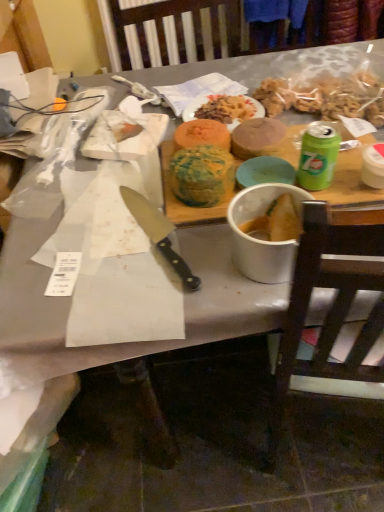
The height and width of the screenshot is (512, 384). Describe the element at coordinates (202, 134) in the screenshot. I see `multicolored cake at center, placed as the second food when sorted from left to right` at that location.

Find the location of `smooth brown cake at center, the 1th food when ordered from right to left`. smooth brown cake at center, the 1th food when ordered from right to left is located at coordinates (257, 138).

The width and height of the screenshot is (384, 512). I want to click on multicolored cake at center, the 2th food in the right-to-left sequence, so click(x=202, y=134).

Between brown wooden chair at right and green and yellow cake at center, placed as the 1th food when sorted from left to right, which one appears on the left side from the viewer's perspective?

green and yellow cake at center, placed as the 1th food when sorted from left to right.

From the image's perspective, is brown wooden chair at right located above or below green and yellow cake at center, the third food viewed from the right?

brown wooden chair at right is below green and yellow cake at center, the third food viewed from the right.

How different are the orientations of brown wooden chair at right and green and yellow cake at center, the third food viewed from the right, in degrees?

The angular difference between brown wooden chair at right and green and yellow cake at center, the third food viewed from the right, is 167 degrees.

Is brown wooden chair at right facing towards green and yellow cake at center, the third food viewed from the right?

No, brown wooden chair at right is not aimed at green and yellow cake at center, the third food viewed from the right.

Find the location of `knife that appears on the left of smooth brown cake at center, the 3th food when ordered from left to right`. knife that appears on the left of smooth brown cake at center, the 3th food when ordered from left to right is located at coordinates (159, 234).

Can you confirm if smooth brown cake at center, the 1th food when ordered from right to left, is wider than black plastic knife at center?

No.

How much distance is there between smooth brown cake at center, the 3th food when ordered from left to right, and black plastic knife at center?

26.88 centimeters.

Does smooth brown cake at center, the 3th food when ordered from left to right, have a smaller size compared to black plastic knife at center?

No.

What's the angular difference between black plastic knife at center and smooth brown cake at center, the 3th food when ordered from left to right,'s facing directions?

black plastic knife at center and smooth brown cake at center, the 3th food when ordered from left to right, are facing 21.4 degrees away from each other.

How far apart are black plastic knife at center and smooth brown cake at center, the 1th food when ordered from right to left?

black plastic knife at center is 10.58 inches away from smooth brown cake at center, the 1th food when ordered from right to left.

Does point (188, 285) come behind point (278, 136)?

No, (188, 285) is in front of (278, 136).

Considering the relative sizes of black plastic knife at center and smooth brown cake at center, the 1th food when ordered from right to left, in the image provided, is black plastic knife at center bigger than smooth brown cake at center, the 1th food when ordered from right to left,?

No, black plastic knife at center is not bigger than smooth brown cake at center, the 1th food when ordered from right to left.

How distant is multicolored cake at center, placed as the second food when sorted from left to right, from white matte bowl at center?

multicolored cake at center, placed as the second food when sorted from left to right, and white matte bowl at center are 24.19 centimeters apart from each other.

Considering the relative sizes of multicolored cake at center, placed as the second food when sorted from left to right, and white matte bowl at center in the image provided, is multicolored cake at center, placed as the second food when sorted from left to right, wider than white matte bowl at center?

Incorrect, the width of multicolored cake at center, placed as the second food when sorted from left to right, does not surpass that of white matte bowl at center.

Is multicolored cake at center, placed as the second food when sorted from left to right, inside or outside of white matte bowl at center?

multicolored cake at center, placed as the second food when sorted from left to right, is not enclosed by white matte bowl at center.

Between multicolored cake at center, the 2th food in the right-to-left sequence, and white matte bowl at center, which one appears on the right side from the viewer's perspective?

white matte bowl at center.

From the picture: How different are the orientations of black plastic knife at center and multicolored cake at center, placed as the second food when sorted from left to right, in degrees?

21.4 degrees separate the facing orientations of black plastic knife at center and multicolored cake at center, placed as the second food when sorted from left to right.

Locate an element on the screen. Image resolution: width=384 pixels, height=512 pixels. knife in front of the multicolored cake at center, placed as the second food when sorted from left to right is located at coordinates (159, 234).

Is black plastic knife at center positioned far away from multicolored cake at center, the 2th food in the right-to-left sequence?

No, black plastic knife at center is not far away from multicolored cake at center, the 2th food in the right-to-left sequence.

From the image's perspective, between black plastic knife at center and multicolored cake at center, placed as the second food when sorted from left to right, who is located below?

black plastic knife at center.

Can you confirm if multicolored cake at center, the 2th food in the right-to-left sequence, is positioned to the right of black plastic knife at center?

Correct, you'll find multicolored cake at center, the 2th food in the right-to-left sequence, to the right of black plastic knife at center.

Is multicolored cake at center, the 2th food in the right-to-left sequence, facing away from black plastic knife at center?

No.

Considering the relative sizes of multicolored cake at center, the 2th food in the right-to-left sequence, and black plastic knife at center in the image provided, is multicolored cake at center, the 2th food in the right-to-left sequence, wider than black plastic knife at center?

No, multicolored cake at center, the 2th food in the right-to-left sequence, is not wider than black plastic knife at center.

Which is in front, multicolored cake at center, placed as the second food when sorted from left to right, or black plastic knife at center?

black plastic knife at center is closer to the camera.

In the scene shown: Considering the positions of objects smooth brown cake at center, the 3th food when ordered from left to right, and white matte bowl at center in the image provided, who is in front, smooth brown cake at center, the 3th food when ordered from left to right, or white matte bowl at center?

white matte bowl at center.

Is smooth brown cake at center, the 1th food when ordered from right to left, positioned far away from white matte bowl at center?

That's not correct — smooth brown cake at center, the 1th food when ordered from right to left, is a little close to white matte bowl at center.

Based on the photo, is smooth brown cake at center, the 1th food when ordered from right to left, inside the boundaries of white matte bowl at center, or outside?

The correct answer is: outside.

How different are the orientations of smooth brown cake at center, the 1th food when ordered from right to left, and white matte bowl at center in degrees?

4.98 degrees separate the facing orientations of smooth brown cake at center, the 1th food when ordered from right to left, and white matte bowl at center.

Identify the location of chair below the green and yellow cake at center, the third food viewed from the right (from a real-world perspective). (331, 307).

Where is `knife below the smooth brown cake at center, the 3th food when ordered from left to right (from the image's perspective)`? knife below the smooth brown cake at center, the 3th food when ordered from left to right (from the image's perspective) is located at coordinates (159, 234).

From the picture: Considering their positions, is white matte bowl at center positioned further to green and yellow cake at center, placed as the 1th food when sorted from left to right, than multicolored cake at center, the 2th food in the right-to-left sequence?

white matte bowl at center is further to green and yellow cake at center, placed as the 1th food when sorted from left to right.

Looking at the image, which one is located further to green and yellow cake at center, the third food viewed from the right, smooth brown cake at center, the 3th food when ordered from left to right, or black plastic knife at center?

smooth brown cake at center, the 3th food when ordered from left to right, lies further to green and yellow cake at center, the third food viewed from the right, than the other object.

Based on their spatial positions, is smooth brown cake at center, the 1th food when ordered from right to left, or multicolored cake at center, placed as the second food when sorted from left to right, closer to brown wooden chair at right?

smooth brown cake at center, the 1th food when ordered from right to left, is positioned closer to the anchor brown wooden chair at right.

In the scene shown: Looking at the image, which one is located closer to white matte bowl at center, multicolored cake at center, placed as the second food when sorted from left to right, or matte orange plate at center?

The object closer to white matte bowl at center is multicolored cake at center, placed as the second food when sorted from left to right.

When comparing their distances from white matte bowl at center, does smooth brown cake at center, the 3th food when ordered from left to right, or matte orange plate at center seem closer?

smooth brown cake at center, the 3th food when ordered from left to right, is positioned closer to the anchor white matte bowl at center.

Based on their spatial positions, is smooth brown cake at center, the 1th food when ordered from right to left, or matte orange plate at center closer to black plastic knife at center?

smooth brown cake at center, the 1th food when ordered from right to left, lies closer to black plastic knife at center than the other object.

Considering their positions, is brown wooden chair at right positioned further to green and yellow cake at center, the third food viewed from the right, than white matte bowl at center?

brown wooden chair at right.

Looking at the image, which one is located further to smooth brown cake at center, the 1th food when ordered from right to left, white matte bowl at center or green and yellow cake at center, placed as the 1th food when sorted from left to right?

white matte bowl at center lies further to smooth brown cake at center, the 1th food when ordered from right to left, than the other object.

The width and height of the screenshot is (384, 512). Identify the location of food that lies between multicolored cake at center, placed as the second food when sorted from left to right, and black plastic knife at center from top to bottom. (202, 175).

Image resolution: width=384 pixels, height=512 pixels. In order to click on knife located between brown wooden chair at right and multicolored cake at center, the 2th food in the right-to-left sequence, in the depth direction in this screenshot , I will do `click(159, 234)`.

I want to click on food between multicolored cake at center, the 2th food in the right-to-left sequence, and matte orange plate at center in the front-back direction, so click(x=257, y=138).

Where is `food located between white matte bowl at center and multicolored cake at center, placed as the second food when sorted from left to right, in the depth direction`? The height and width of the screenshot is (512, 384). food located between white matte bowl at center and multicolored cake at center, placed as the second food when sorted from left to right, in the depth direction is located at coordinates (202, 175).